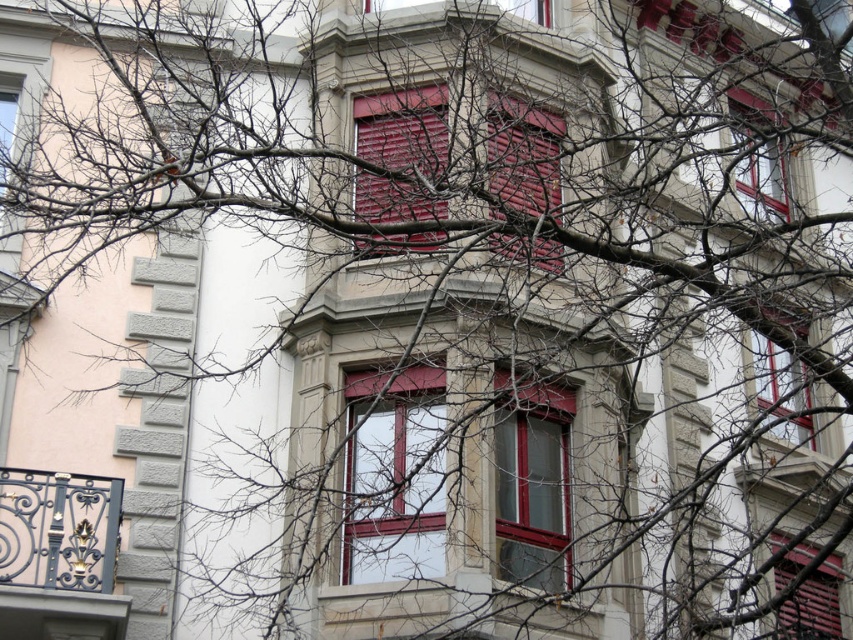
Does matte glass window at center have a greater height compared to matte red shutter at center?

Incorrect, matte glass window at center's height is not larger of matte red shutter at center's.

In order to click on matte glass window at center in this screenshot , I will do `click(393, 476)`.

Measure the distance between matte wood shutter at center and camera.

matte wood shutter at center is 121.25 feet from camera.

Which of these two, matte wood shutter at center or matte glass window at upper right, stands taller?

Standing taller between the two is matte wood shutter at center.

Is point (544, 128) in front of point (782, 353)?

Yes.

In order to click on matte wood shutter at center in this screenshot , I will do `click(524, 156)`.

Can you confirm if matte red shutter at center is shorter than matte red shutter at lower right?

In fact, matte red shutter at center may be taller than matte red shutter at lower right.

Between point (431, 218) and point (827, 609), which one is positioned in front?

Point (431, 218)

Locate an element on the screen. Image resolution: width=853 pixels, height=640 pixels. matte red shutter at center is located at coordinates (404, 131).